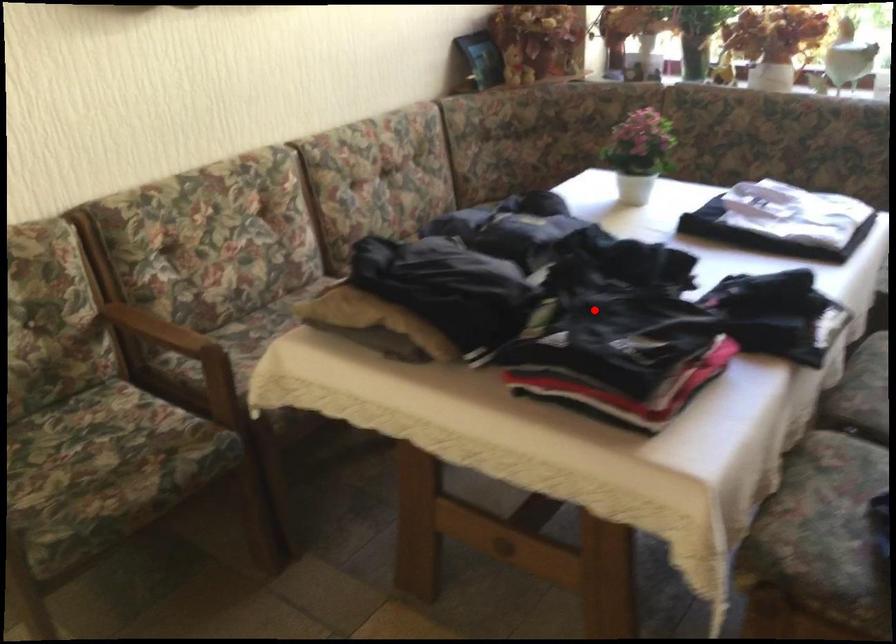
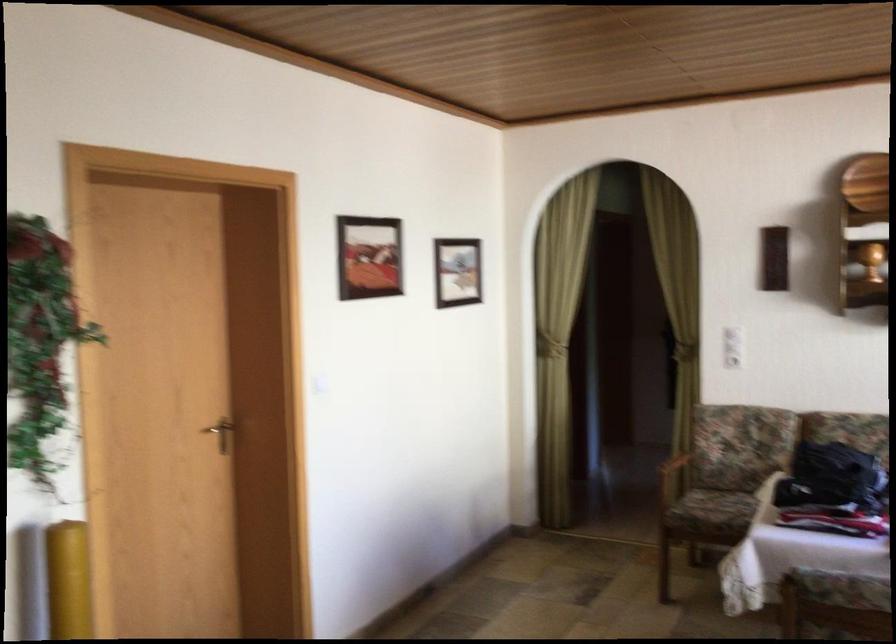
Find the pixel in the second image that matches the highlighted location in the first image.

(831, 478)